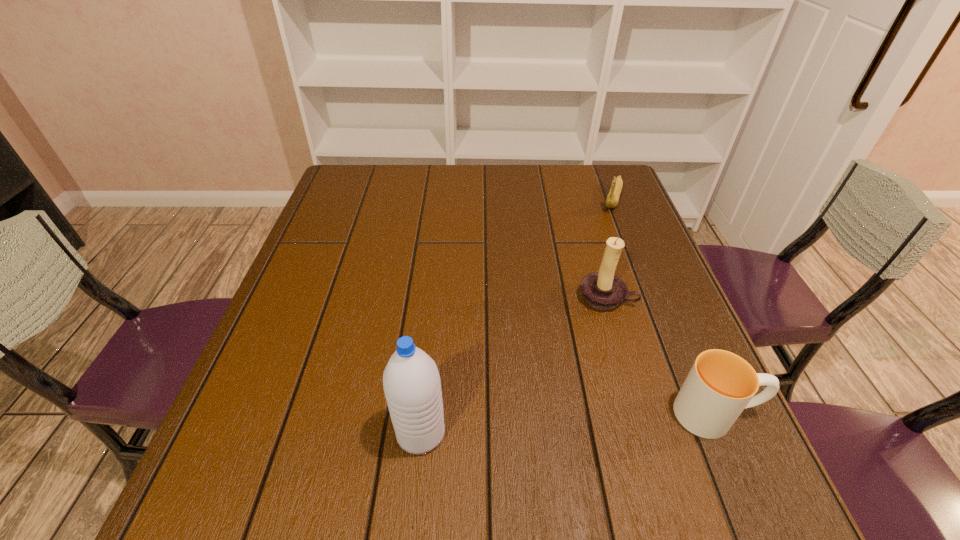
The image size is (960, 540). In order to click on free spot located on the wick of the second tallest object in this screenshot , I will do `click(560, 427)`.

What are the coordinates of `vacant area located on the wick of the second tallest object` in the screenshot? It's located at (584, 356).

The image size is (960, 540). I want to click on free spot located 0.130m on the wick of the second tallest object, so click(584, 356).

Image resolution: width=960 pixels, height=540 pixels. Find the location of `object that is at the far edge`. object that is at the far edge is located at coordinates (612, 199).

Where is `water bottle that is at the near edge`? The height and width of the screenshot is (540, 960). water bottle that is at the near edge is located at coordinates (411, 382).

Identify the location of cup located at the near edge. This screenshot has width=960, height=540. (720, 385).

Identify the location of cup located in the right edge section of the desktop. (720, 385).

Image resolution: width=960 pixels, height=540 pixels. What are the coordinates of `banana present at the right edge` in the screenshot? It's located at (612, 199).

This screenshot has height=540, width=960. I want to click on candle holder located in the right edge section of the desktop, so pyautogui.click(x=603, y=290).

Find the location of a particular element. This screenshot has width=960, height=540. object positioned at the far right corner is located at coordinates (612, 199).